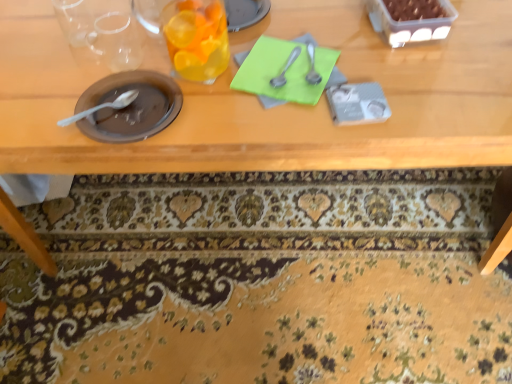
Find the location of a particular element. free location in front of satin silver spoon at center, positioned as the third tableware in left-to-right order is located at coordinates (288, 117).